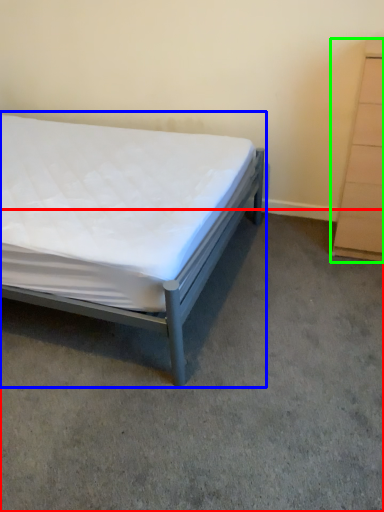
Question: Which is farther away from concrete (highlighted by a red box)? bed (highlighted by a blue box) or chest of drawers (highlighted by a green box)?

Choices:
 (A) bed
 (B) chest of drawers

Answer: (B)